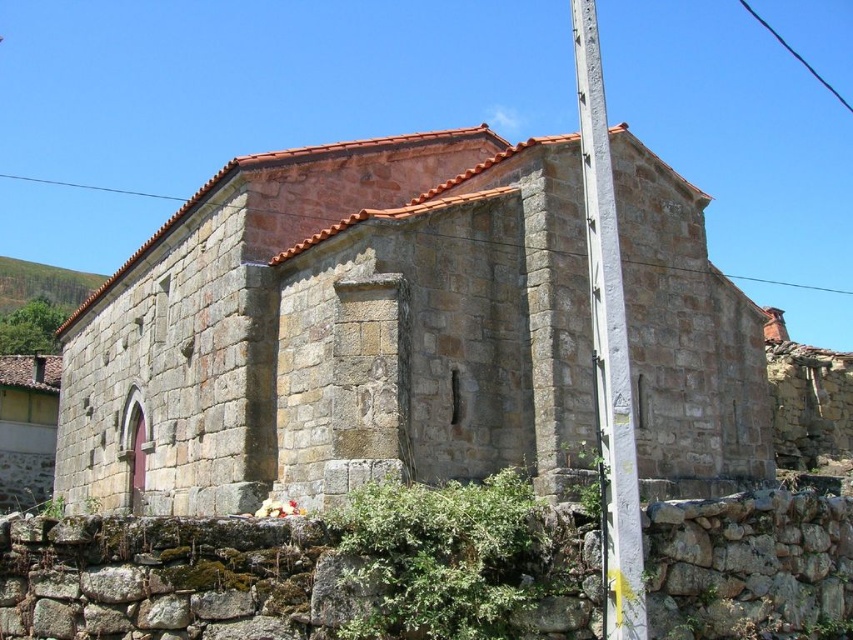
Does stone chapel at center have a larger size compared to white painted metal pole at right?

Indeed, stone chapel at center has a larger size compared to white painted metal pole at right.

Is stone chapel at center taller than white painted metal pole at right?

In fact, stone chapel at center may be shorter than white painted metal pole at right.

This screenshot has width=853, height=640. What do you see at coordinates (338, 328) in the screenshot?
I see `stone chapel at center` at bounding box center [338, 328].

You are a GUI agent. You are given a task and a screenshot of the screen. Output one action in this format:
    pyautogui.click(x=<x>, y=<y>)
    Task: Click on the stone chapel at center
    The width and height of the screenshot is (853, 640).
    Given the screenshot: What is the action you would take?
    pyautogui.click(x=338, y=328)